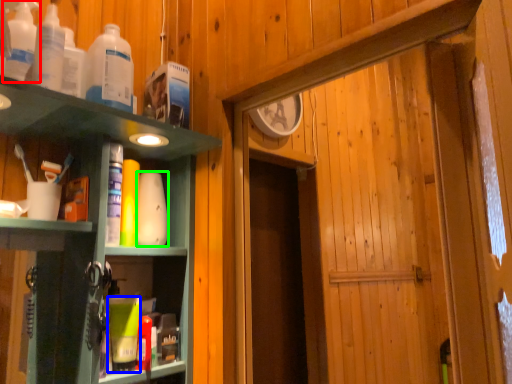
Question: Which is nearer to the bottle (highlighted by a red box)? toiletry (highlighted by a blue box) or toiletry (highlighted by a green box).

Choices:
 (A) toiletry
 (B) toiletry

Answer: (B)